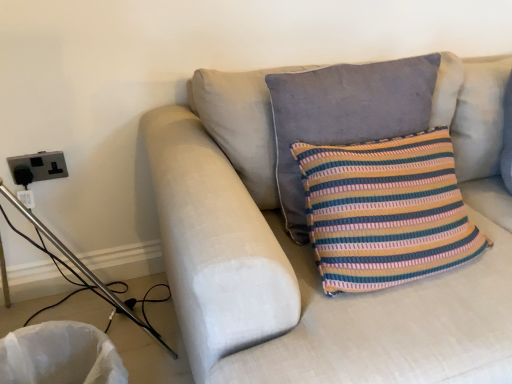
Question: Is light beige fabric couch at center in front of or behind black plastic outlet at left in the image?

Choices:
 (A) front
 (B) behind

Answer: (A)

Question: From a real-world perspective, is light beige fabric couch at center physically located above or below black plastic outlet at left?

Choices:
 (A) above
 (B) below

Answer: (B)

Question: Which is nearer to the striped fabric cushion at upper right, marked as the second pillow in a left-to-right arrangement?

Choices:
 (A) light beige fabric couch at center
 (B) black plastic outlet at left
 (C) striped fabric pillow at center, marked as the second pillow in a right-to-left arrangement

Answer: (C)

Question: Estimate the real-world distances between objects in this image. Which object is farther from the light beige fabric couch at center?

Choices:
 (A) black plastic outlet at left
 (B) striped fabric cushion at upper right, positioned as the 1th pillow in right-to-left order
 (C) striped fabric pillow at center, marked as the second pillow in a right-to-left arrangement

Answer: (A)